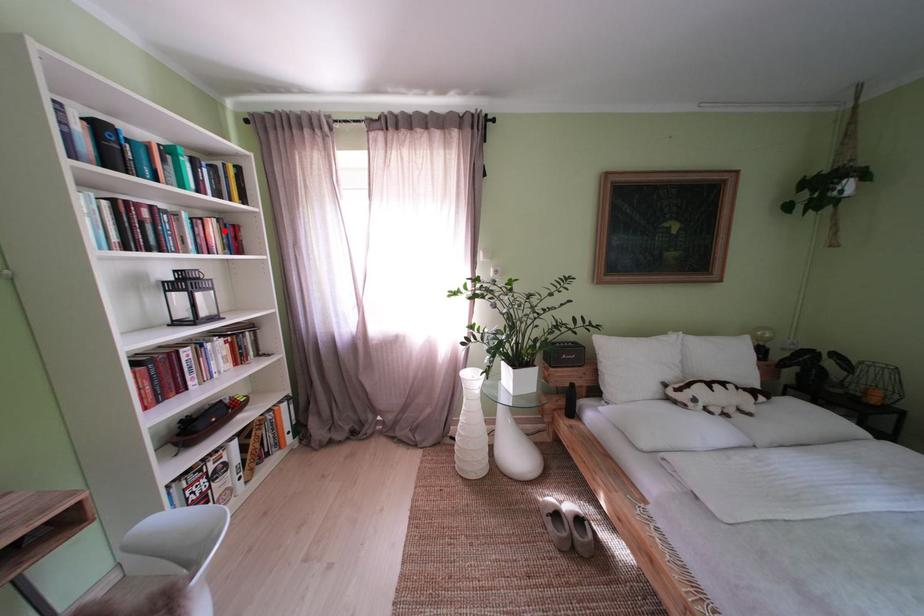
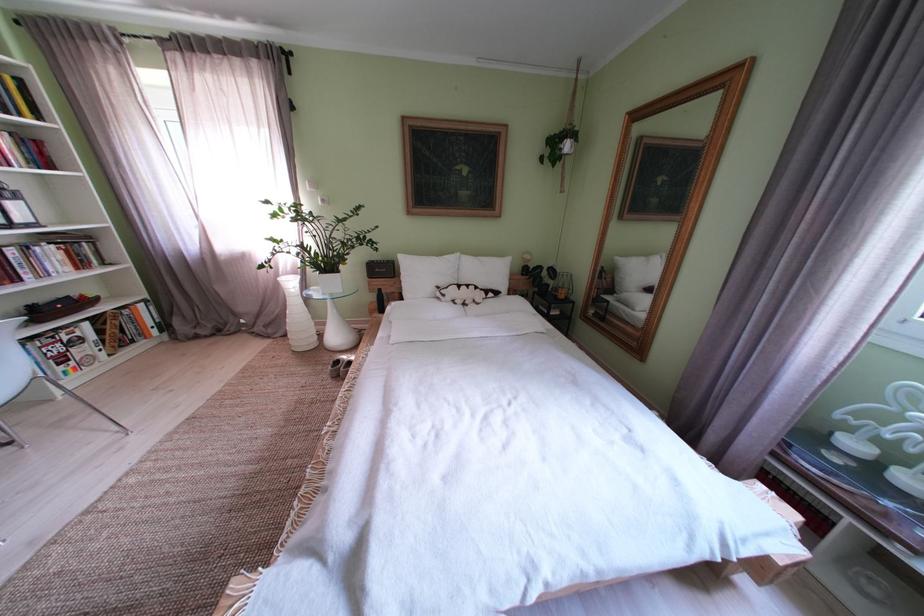
Question: I am providing you with two images of the same scene from different viewpoints. In image1, a red point is highlighted. Considering the same 3D point in image2, which of the following is correct?

Choices:
 (A) It is closer
 (B) It is farther

Answer: (B)